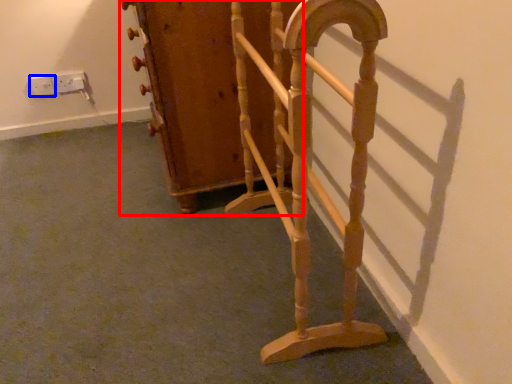
Question: Which object is further to the camera taking this photo, furniture (highlighted by a red box) or electric outlet (highlighted by a blue box)?

Choices:
 (A) furniture
 (B) electric outlet

Answer: (B)